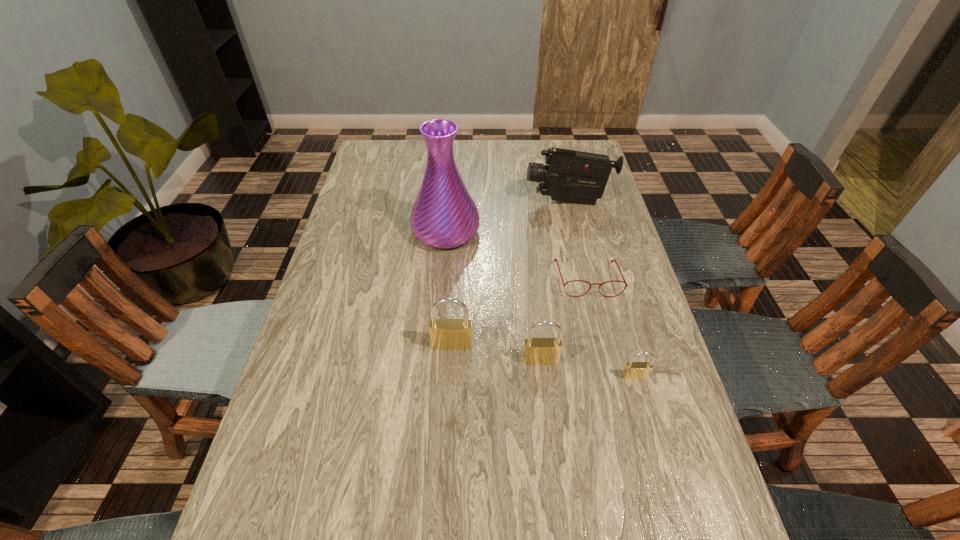
Find the location of a particular element. The width and height of the screenshot is (960, 540). camcorder that is at the right edge is located at coordinates (569, 175).

Find the location of a particular element. The width and height of the screenshot is (960, 540). spectacles at the right edge is located at coordinates (555, 259).

The image size is (960, 540). Find the location of `free location at the far edge of the desktop`. free location at the far edge of the desktop is located at coordinates (518, 155).

Find the location of `free point at the near edge`. free point at the near edge is located at coordinates (613, 508).

Image resolution: width=960 pixels, height=540 pixels. I want to click on blank space at the left edge of the desktop, so click(400, 174).

Where is `vacant space at the right edge`? vacant space at the right edge is located at coordinates (625, 440).

In the image, there is a desktop. Identify the location of free space at the near left corner. This screenshot has width=960, height=540. (301, 511).

Identify the location of vacant space at the far right corner of the desktop. (574, 148).

Where is `vacant space at the near right corner of the desktop`? This screenshot has width=960, height=540. vacant space at the near right corner of the desktop is located at coordinates (666, 502).

Where is `vacant area that lies between the vase and the farthest object`? The image size is (960, 540). vacant area that lies between the vase and the farthest object is located at coordinates (507, 217).